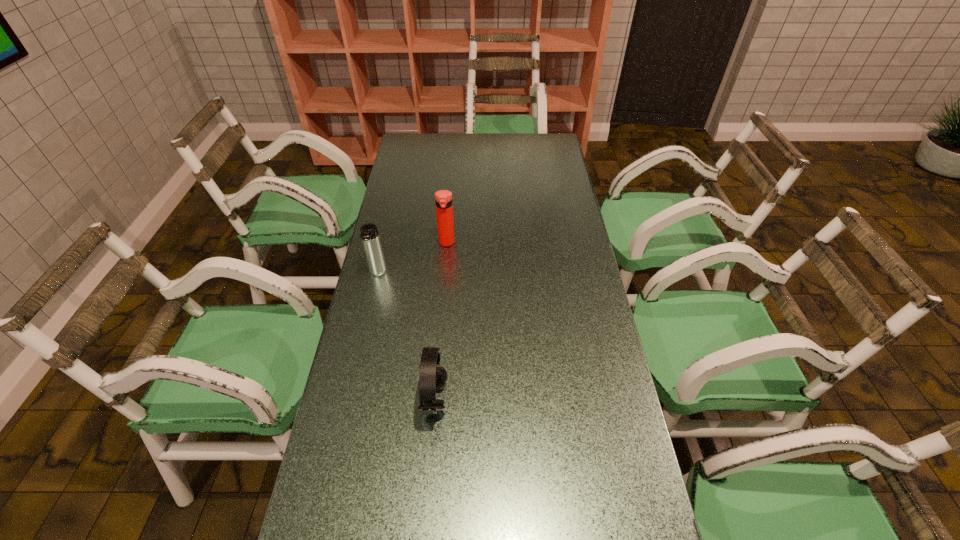
What are the coordinates of `vacant area that lies between the earphone and the leftmost object` in the screenshot? It's located at (406, 337).

Locate which object ranks second in proximity to the farther thermos bottle. Please provide its 2D coordinates. Your answer should be formatted as a tuple, i.e. [(x, y)], where the tuple contains the x and y coordinates of a point satisfying the conditions above.

[(433, 376)]

Locate an element on the screen. object that stands as the closest to the farthest object is located at coordinates coord(369,234).